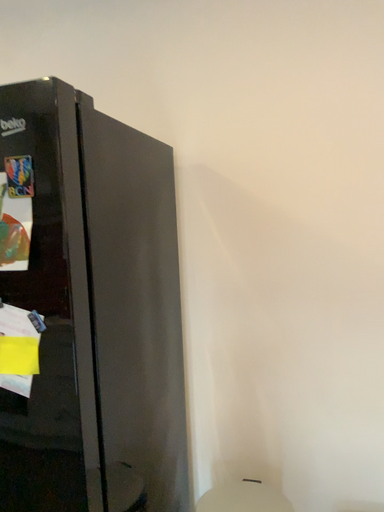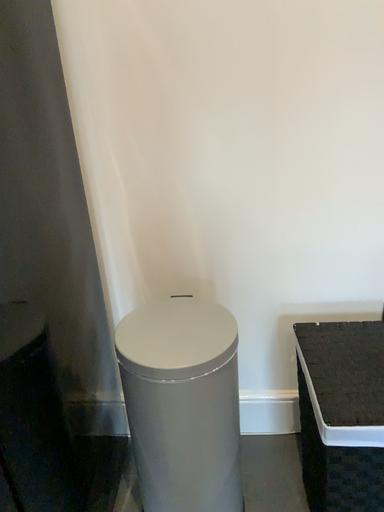
Question: How did the camera likely rotate when shooting the video?

Choices:
 (A) rotated upward
 (B) rotated downward

Answer: (B)